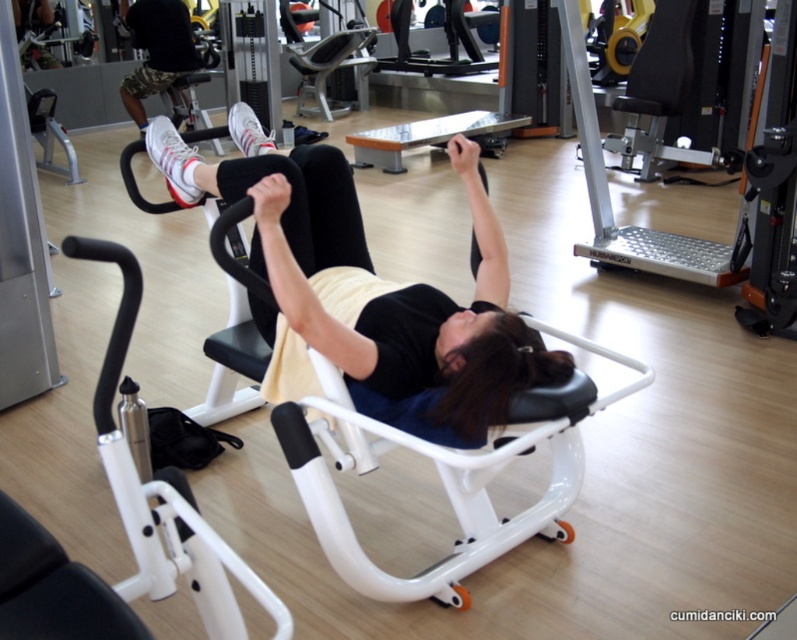
Measure the distance between point (489,259) and camera.

The distance of point (489,259) from camera is 7.43 feet.

Who is shorter, black matte exercise machine at center or black camouflage shorts at upper left?

Standing shorter between the two is black camouflage shorts at upper left.

Between point (293, 188) and point (132, 90), which one is positioned behind?

The point (132, 90) is more distant.

Locate an element on the screen. This screenshot has height=640, width=797. black matte exercise machine at center is located at coordinates (379, 292).